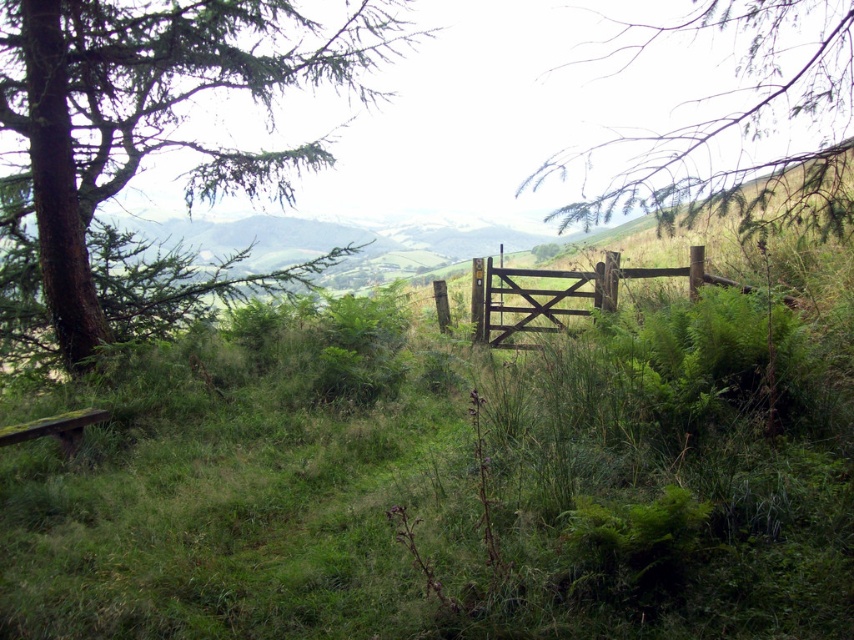
Is green leafy tree at upper left bigger than brown wooden gate at center?

Indeed, green leafy tree at upper left has a larger size compared to brown wooden gate at center.

Which is above, green leafy tree at upper left or brown wooden gate at center?

Positioned higher is green leafy tree at upper left.

Locate an element on the screen. Image resolution: width=854 pixels, height=640 pixels. green leafy tree at upper left is located at coordinates (145, 148).

Locate an element on the screen. This screenshot has height=640, width=854. green leafy tree at upper left is located at coordinates (145, 148).

Does point (249, 189) lie behind point (806, 44)?

Yes, it is behind point (806, 44).

Is green leafy tree at upper left wider than green leafy branch at upper right?

Correct, the width of green leafy tree at upper left exceeds that of green leafy branch at upper right.

The image size is (854, 640). Describe the element at coordinates (145, 148) in the screenshot. I see `green leafy tree at upper left` at that location.

Where is `green leafy tree at upper left`? This screenshot has height=640, width=854. green leafy tree at upper left is located at coordinates (145, 148).

Does green leafy branch at upper right appear over brown wooden gate at center?

Yes, green leafy branch at upper right is above brown wooden gate at center.

Who is higher up, green leafy branch at upper right or brown wooden gate at center?

green leafy branch at upper right

Find the location of `green leafy branch at upper right`. green leafy branch at upper right is located at coordinates (740, 124).